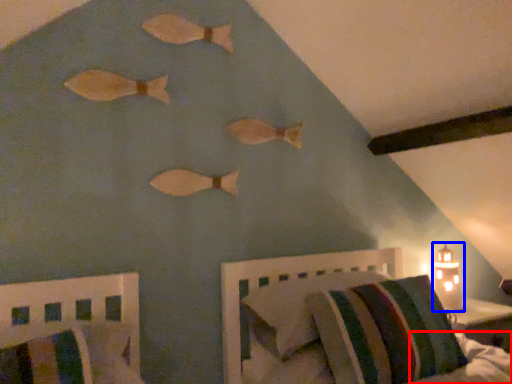
Question: Which object is further to the camera taking this photo, mattress (highlighted by a red box) or table lamp (highlighted by a blue box)?

Choices:
 (A) mattress
 (B) table lamp

Answer: (B)